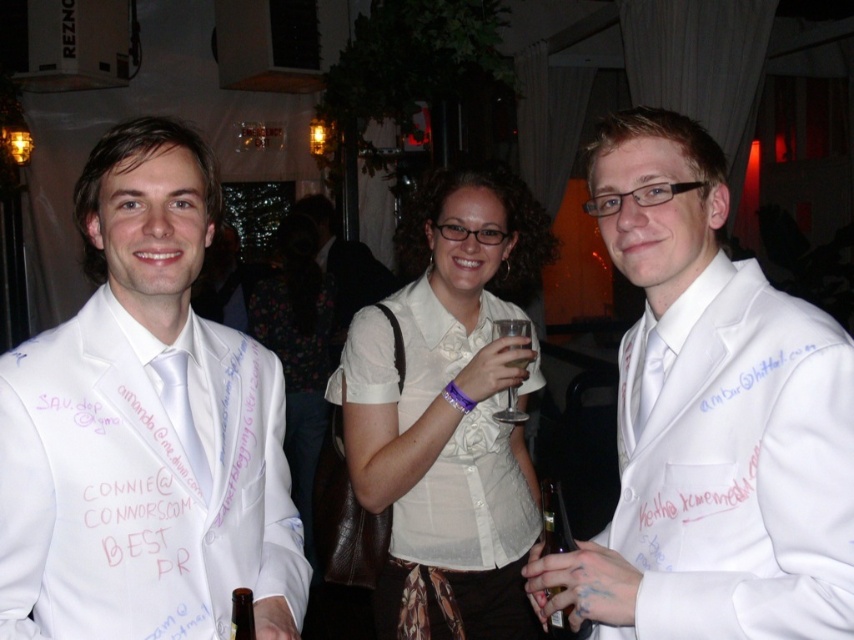
Question: Is translucent glass bottle at right positioned at the back of clear glass wine glass at center?

Choices:
 (A) no
 (B) yes

Answer: (A)

Question: Does translucent glass bottle at right appear on the left side of brown glass bottle at lower left?

Choices:
 (A) no
 (B) yes

Answer: (A)

Question: Which is nearer to the matte white suit at center?

Choices:
 (A) brown glass bottle at lower left
 (B) white floral blouse at center
 (C) white satin blouse at center
 (D) translucent glass bottle at right

Answer: (A)

Question: Does white satin blouse at center have a smaller size compared to brown glass bottle at lower left?

Choices:
 (A) yes
 (B) no

Answer: (B)

Question: Based on their relative distances, which object is nearer to the white satin suit at center?

Choices:
 (A) translucent glass bottle at right
 (B) white floral blouse at center
 (C) white satin blouse at center

Answer: (A)

Question: Which point appears closest to the camera in this image?

Choices:
 (A) (481, 605)
 (B) (544, 541)
 (C) (194, 182)

Answer: (C)